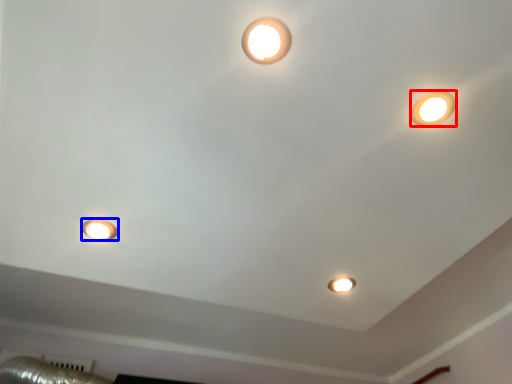
Question: Which of the following is the farthest to the observer, lamp (highlighted by a red box) or lamp (highlighted by a blue box)?

Choices:
 (A) lamp
 (B) lamp

Answer: (B)